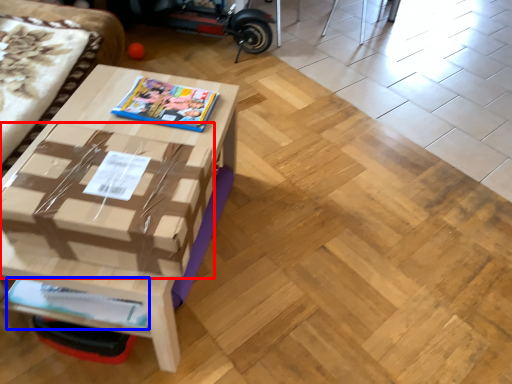
Question: Which point is further to the camera, cardboard box (highlighted by a red box) or magazine (highlighted by a blue box)?

Choices:
 (A) cardboard box
 (B) magazine

Answer: (B)